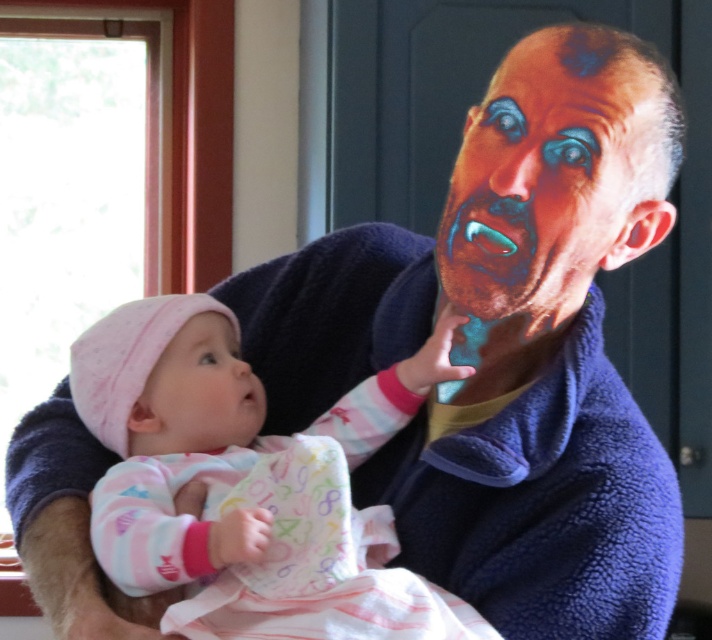
Based on the photo, measure the distance between shiny blue face at upper right and smooth pink fabric at center.

The distance of shiny blue face at upper right from smooth pink fabric at center is 15.92 inches.

Between shiny blue face at upper right and smooth pink fabric at center, which one is positioned higher?

shiny blue face at upper right is above.

Find the location of a particular element. The image size is (712, 640). shiny blue face at upper right is located at coordinates (543, 184).

This screenshot has width=712, height=640. I want to click on shiny blue face at upper right, so click(543, 184).

Who is positioned more to the right, pink fleece onesie at center or smooth pink fabric at center?

From the viewer's perspective, pink fleece onesie at center appears more on the right side.

Between pink fleece onesie at center and smooth pink fabric at center, which one appears on the left side from the viewer's perspective?

From the viewer's perspective, smooth pink fabric at center appears more on the left side.

Which is in front, point (342, 611) or point (216, 451)?

Positioned in front is point (342, 611).

You are a GUI agent. You are given a task and a screenshot of the screen. Output one action in this format:
    pyautogui.click(x=<x>, y=<y>)
    Task: Click on the pink fleece onesie at center
    This screenshot has height=640, width=712.
    Given the screenshot: What is the action you would take?
    pyautogui.click(x=248, y=483)

Based on the photo, does pink fleece onesie at center appear over shiny blue face at upper right?

No, pink fleece onesie at center is not above shiny blue face at upper right.

Is point (372, 627) farther from viewer compared to point (565, 301)?

That is False.

The image size is (712, 640). Find the location of `pink fleece onesie at center`. pink fleece onesie at center is located at coordinates (248, 483).